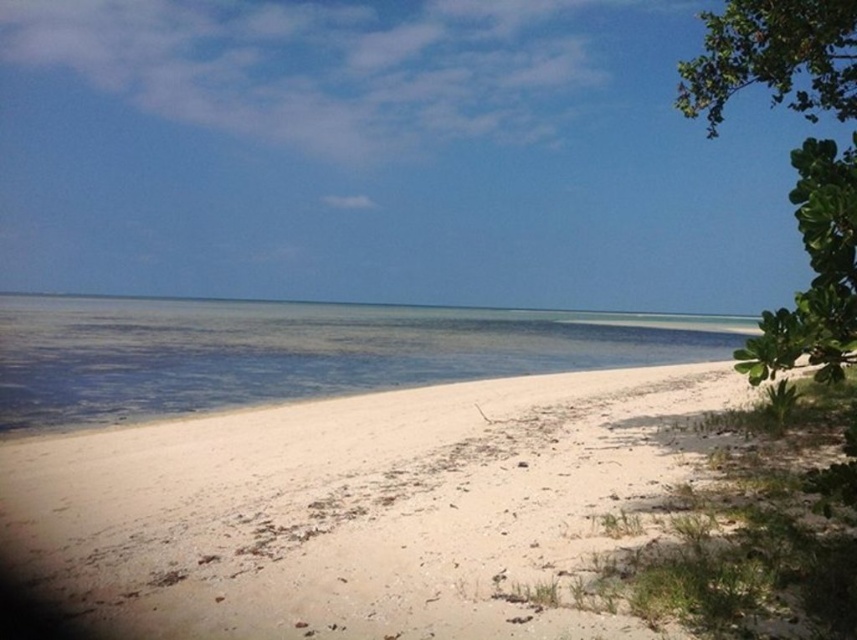
Between clear water at center and green leafy tree at upper right, which one appears on the right side from the viewer's perspective?

From the viewer's perspective, green leafy tree at upper right appears more on the right side.

Does point (205, 307) lie behind point (832, 45)?

Yes, it is behind point (832, 45).

Is point (175, 365) less distant than point (836, 51)?

No, it is behind (836, 51).

What are the coordinates of `clear water at center` in the screenshot? It's located at (298, 352).

Does white sandy beach at lower right have a lesser width compared to green leafy tree at upper right?

Yes.

In the scene shown: Can you confirm if white sandy beach at lower right is positioned above green leafy tree at upper right?

Incorrect, white sandy beach at lower right is not positioned above green leafy tree at upper right.

Locate an element on the screen. This screenshot has width=857, height=640. white sandy beach at lower right is located at coordinates (358, 508).

Which is above, white sandy beach at lower right or clear water at center?

clear water at center is higher up.

Which of these two, white sandy beach at lower right or clear water at center, stands shorter?

Standing shorter between the two is white sandy beach at lower right.

Locate an element on the screen. white sandy beach at lower right is located at coordinates (358, 508).